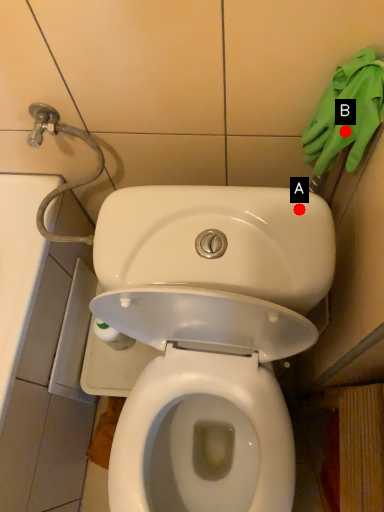
Question: Two points are circled on the image, labeled by A and B beside each circle. Which point is closer to the camera?

Choices:
 (A) A is closer
 (B) B is closer

Answer: (B)